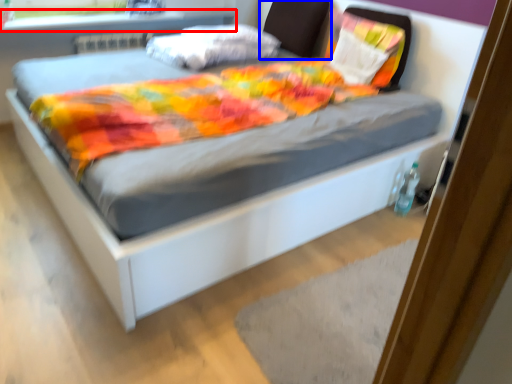
Question: Which of the following is the closest to the observer, window sill (highlighted by a red box) or headboard (highlighted by a blue box)?

Choices:
 (A) window sill
 (B) headboard

Answer: (A)